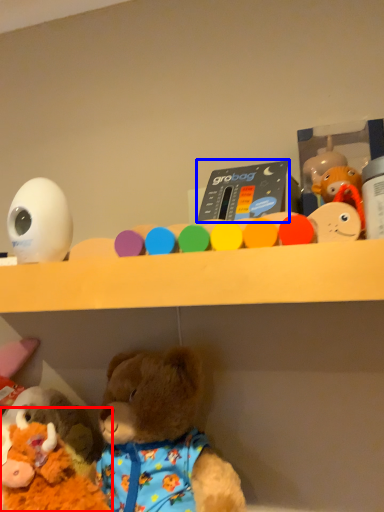
Question: Among these objects, which one is nearest to the camera, toy (highlighted by a red box) or toy (highlighted by a blue box)?

Choices:
 (A) toy
 (B) toy

Answer: (A)